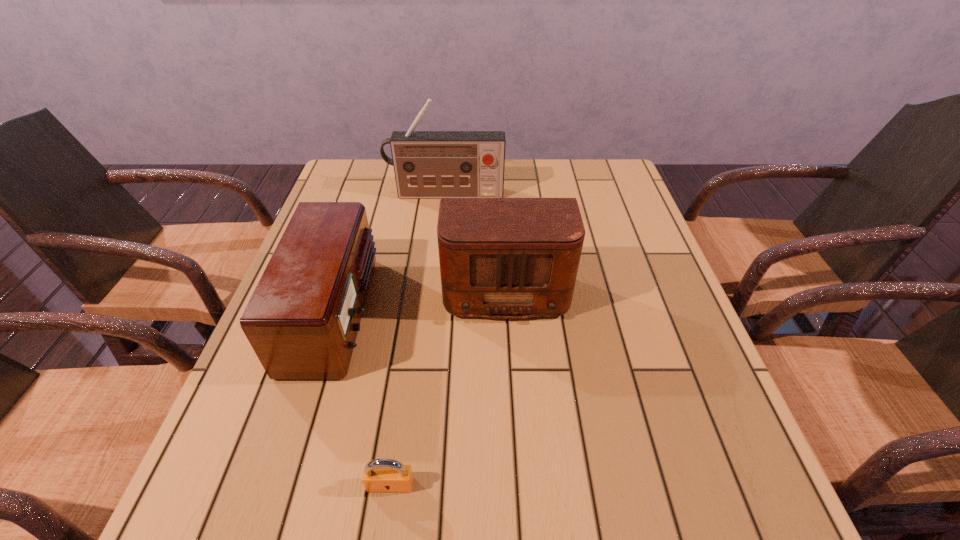
I want to click on the second closest radio receiver to the padlock, so click(x=499, y=257).

Locate an element on the screen. radio receiver that can be found as the second closest to the tallest object is located at coordinates (302, 320).

This screenshot has height=540, width=960. In order to click on free space that satisfies the following two spatial constraints: 1. on the front panel of the second tallest radio receiver; 2. on the front-facing side of the third tallest object in this screenshot , I will do `click(507, 313)`.

Where is `vacant space that satisfies the following two spatial constraints: 1. on the front panel of the tallest radio receiver; 2. on the front-facing side of the third tallest object`? Image resolution: width=960 pixels, height=540 pixels. vacant space that satisfies the following two spatial constraints: 1. on the front panel of the tallest radio receiver; 2. on the front-facing side of the third tallest object is located at coordinates (433, 313).

Image resolution: width=960 pixels, height=540 pixels. Identify the location of blank space that satisfies the following two spatial constraints: 1. on the front panel of the second tallest object; 2. on the front-facing side of the shortest radio receiver. (507, 313).

The height and width of the screenshot is (540, 960). Find the location of `free location that satisfies the following two spatial constraints: 1. on the front panel of the tallest object; 2. on the front-facing side of the third tallest object`. free location that satisfies the following two spatial constraints: 1. on the front panel of the tallest object; 2. on the front-facing side of the third tallest object is located at coordinates (433, 313).